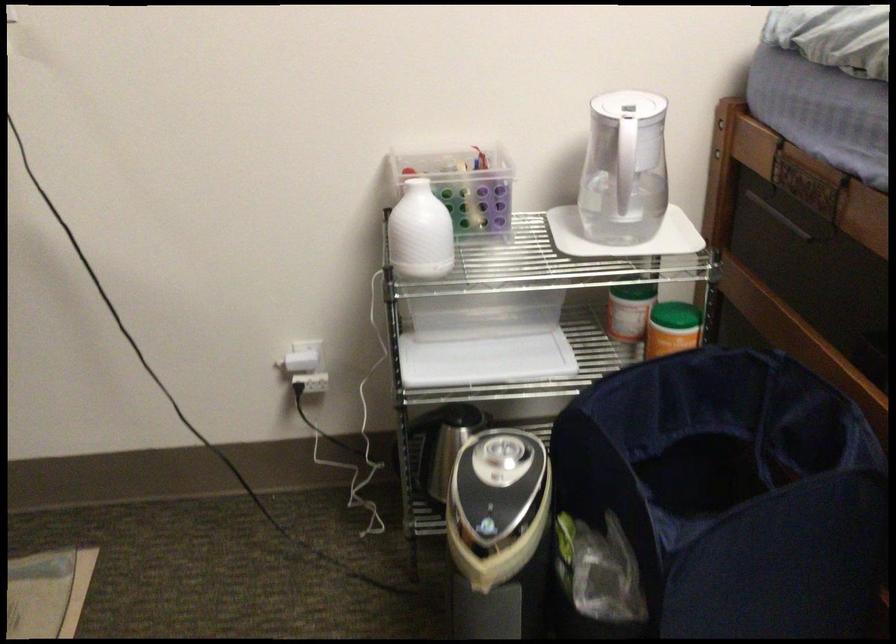
Find where to lift the white pitcher handle. Please return your answer as a coordinate pair (x, y).

(630, 144)